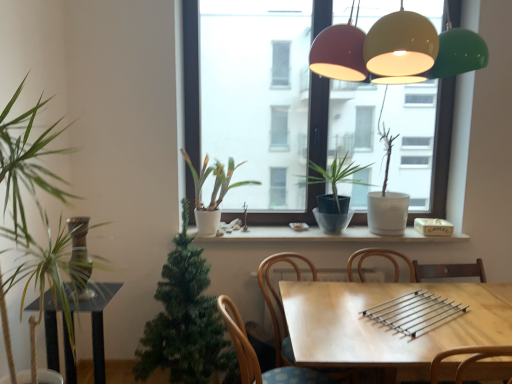
What do you see at coordinates (35, 203) in the screenshot? I see `green leafy plant at left, placed as the first houseplant when sorted from left to right` at bounding box center [35, 203].

In order to face green matte artificial tree at lower center, which is counted as the second houseplant, starting from the left, should I rotate leftwards or rightwards?

You should rotate left by 9.250 degrees.

Measure the distance between point (54, 357) and camera.

A distance of 7.43 feet exists between point (54, 357) and camera.

Describe the element at coordinates (334, 192) in the screenshot. I see `green matte plant at center, the 2th houseplant positioned from the right` at that location.

This screenshot has height=384, width=512. What are the coordinates of `wooden table at center` in the screenshot? It's located at (386, 326).

You are a GUI agent. You are given a task and a screenshot of the screen. Output one action in this format:
    pyautogui.click(x=<x>, y=<y>)
    Task: Click on the green leafy plant at left, placed as the first houseplant when sorted from left to right
    The width and height of the screenshot is (512, 384).
    Given the screenshot: What is the action you would take?
    pyautogui.click(x=35, y=203)

From the image's perspective, is green leafy plant at left, placed as the first houseplant when sorted from left to right, on wooden chair at center?

Yes, from the image's perspective, green leafy plant at left, placed as the first houseplant when sorted from left to right, is above wooden chair at center.

Which is more to the right, green leafy plant at left, positioned as the fifth houseplant in right-to-left order, or wooden chair at center?

wooden chair at center.

From a real-world perspective, which is physically below, green leafy plant at left, positioned as the fifth houseplant in right-to-left order, or wooden chair at center?

From a 3D spatial view, wooden chair at center is below.

Does point (104, 223) come farther from viewer compared to point (247, 352)?

Yes, it is behind point (247, 352).

Does wooden table at center touch green leafy plant at left, positioned as the fifth houseplant in right-to-left order?

No, wooden table at center is not touching green leafy plant at left, positioned as the fifth houseplant in right-to-left order.

Is point (373, 304) less distant than point (28, 256)?

No, (373, 304) is further to viewer.

The height and width of the screenshot is (384, 512). Identify the location of table behind the green leafy plant at left, positioned as the fifth houseplant in right-to-left order. (386, 326).

How far apart are wooden table at center and green leafy plant at left, positioned as the fifth houseplant in right-to-left order?

A distance of 1.25 meters exists between wooden table at center and green leafy plant at left, positioned as the fifth houseplant in right-to-left order.

Is white matte pot at center, which ranks as the 1th houseplant in right-to-left order, surrounded by green matte plant at center, marked as the 4th houseplant in a left-to-right arrangement?

That's incorrect, white matte pot at center, which ranks as the 1th houseplant in right-to-left order, is not inside green matte plant at center, marked as the 4th houseplant in a left-to-right arrangement.

Is green matte plant at center, the 2th houseplant positioned from the right, facing towards white matte pot at center, which ranks as the 1th houseplant in right-to-left order?

No, green matte plant at center, the 2th houseplant positioned from the right, is not turned towards white matte pot at center, which ranks as the 1th houseplant in right-to-left order.

Which houseplant is the 2nd one when counting from the front of the white matte pot at center, which ranks as the 1th houseplant in right-to-left order? Please provide its 2D coordinates.

[(334, 192)]

Would you say green leafy plant at left, positioned as the fifth houseplant in right-to-left order, is inside or outside green matte artificial tree at lower center, which is counted as the second houseplant, starting from the left?

green leafy plant at left, positioned as the fifth houseplant in right-to-left order, is not inside green matte artificial tree at lower center, which is counted as the second houseplant, starting from the left, it's outside.

Consider the image. Can you confirm if green leafy plant at left, placed as the first houseplant when sorted from left to right, is bigger than green matte artificial tree at lower center, which is counted as the second houseplant, starting from the left?

Actually, green leafy plant at left, placed as the first houseplant when sorted from left to right, might be smaller than green matte artificial tree at lower center, which is counted as the second houseplant, starting from the left.

Between point (19, 238) and point (212, 348), which one is positioned in front?

The point (19, 238) is closer to the camera.

Is the surface of green leafy plant at left, placed as the first houseplant when sorted from left to right, in direct contact with green matte artificial tree at lower center, the 4th houseplant positioned from the right?

No, green leafy plant at left, placed as the first houseplant when sorted from left to right, is not touching green matte artificial tree at lower center, the 4th houseplant positioned from the right.

Considering the sizes of transparent glass window at center and wooden chair at center in the image, is transparent glass window at center taller or shorter than wooden chair at center?

Clearly, transparent glass window at center is taller compared to wooden chair at center.

From a real-world perspective, which object stands above the other?

In real-world perspective, transparent glass window at center is above.

From the image's perspective, relative to wooden chair at center, is transparent glass window at center above or below?

Clearly, from the image's perspective, transparent glass window at center is above wooden chair at center.

Based on the photo, looking at their sizes, would you say white matte pot at center, which ranks as the 1th houseplant in right-to-left order, is wider or thinner than matte glass lampshades at upper center?

white matte pot at center, which ranks as the 1th houseplant in right-to-left order, is thinner than matte glass lampshades at upper center.

Find the location of a particular element. The height and width of the screenshot is (384, 512). lamp lying above the white matte pot at center, which is the fifth houseplant in left-to-right order (from the image's perspective) is located at coordinates (396, 51).

Is white matte pot at center, which is the fifth houseplant in left-to-right order, directly adjacent to matte glass lampshades at upper center?

No, white matte pot at center, which is the fifth houseplant in left-to-right order, is not making contact with matte glass lampshades at upper center.

Is point (389, 159) farther from viewer compared to point (344, 55)?

Yes.

At what (x,y) coordinates should I click in order to perform the action: click on houseplant that is the 3rd one when counting backward from the green matte artificial tree at lower center, which is counted as the second houseplant, starting from the left. Please return your answer as a coordinate pair (x, y). Looking at the image, I should click on (387, 198).

Would you say green matte artificial tree at lower center, the 4th houseplant positioned from the right, is inside or outside white matte pot at center, which ranks as the 1th houseplant in right-to-left order?

green matte artificial tree at lower center, the 4th houseplant positioned from the right, is not enclosed by white matte pot at center, which ranks as the 1th houseplant in right-to-left order.

Is green matte artificial tree at lower center, which is counted as the second houseplant, starting from the left, far from white matte pot at center, which ranks as the 1th houseplant in right-to-left order?

Indeed, green matte artificial tree at lower center, which is counted as the second houseplant, starting from the left, is not near white matte pot at center, which ranks as the 1th houseplant in right-to-left order.

From the image's perspective, would you say green matte artificial tree at lower center, which is counted as the second houseplant, starting from the left, is positioned over white matte pot at center, which is the fifth houseplant in left-to-right order?

No.

Which houseplant is the 3rd one when counting from the left side of the wooden chair at center? Please provide its 2D coordinates.

[(35, 203)]

Locate an element on the screen. This screenshot has width=512, height=384. table on the right of the green leafy plant at left, placed as the first houseplant when sorted from left to right is located at coordinates (386, 326).

Looking at the image, which one is located closer to black glass coffee table at lower left, wooden table at center or wooden chair at center?

wooden chair at center.

Based on their spatial positions, is white matte plant at center, positioned as the third houseplant in right-to-left order, or wooden table at center closer to white ceramic window sill at center?

white matte plant at center, positioned as the third houseplant in right-to-left order, is closer to white ceramic window sill at center.

Estimate the real-world distances between objects in this image. Which object is closer to transparent glass window at center, green matte artificial tree at lower center, which is counted as the second houseplant, starting from the left, or matte glass lampshades at upper center?

Among the two, green matte artificial tree at lower center, which is counted as the second houseplant, starting from the left, is located nearer to transparent glass window at center.

Which object lies further to the anchor point white matte pot at center, which is the fifth houseplant in left-to-right order, matte glass lampshades at upper center or white matte plant at center, positioned as the third houseplant in right-to-left order?

matte glass lampshades at upper center is further to white matte pot at center, which is the fifth houseplant in left-to-right order.

Estimate the real-world distances between objects in this image. Which object is further from transparent glass window at center, white matte pot at center, which ranks as the 1th houseplant in right-to-left order, or wooden table at center?

wooden table at center is positioned further to the anchor transparent glass window at center.

From the image, which object appears to be nearer to black glass coffee table at lower left, white ceramic window sill at center or transparent glass window at center?

white ceramic window sill at center is closer to black glass coffee table at lower left.

Estimate the real-world distances between objects in this image. Which object is closer to green matte artificial tree at lower center, the 4th houseplant positioned from the right, white matte plant at center, placed as the 3th houseplant when sorted from left to right, or white ceramic window sill at center?

Among the two, white matte plant at center, placed as the 3th houseplant when sorted from left to right, is located nearer to green matte artificial tree at lower center, the 4th houseplant positioned from the right.

Which object lies further to the anchor point green matte plant at center, the 2th houseplant positioned from the right, green leafy plant at left, positioned as the fifth houseplant in right-to-left order, or white matte plant at center, positioned as the third houseplant in right-to-left order?

green leafy plant at left, positioned as the fifth houseplant in right-to-left order, lies further to green matte plant at center, the 2th houseplant positioned from the right, than the other object.

Image resolution: width=512 pixels, height=384 pixels. I want to click on window sill between transparent glass window at center and green matte artificial tree at lower center, which is counted as the second houseplant, starting from the left, from top to bottom, so click(x=323, y=235).

Identify the location of coffee table positioned between matte glass lampshades at upper center and white matte plant at center, positioned as the third houseplant in right-to-left order, from near to far. The image size is (512, 384). (95, 319).

Locate an element on the screen. The image size is (512, 384). window sill located between black glass coffee table at lower left and green matte plant at center, the 2th houseplant positioned from the right, in the left-right direction is located at coordinates (323, 235).

Locate an element on the screen. table between wooden chair at center and green matte plant at center, marked as the 4th houseplant in a left-to-right arrangement, from front to back is located at coordinates (386, 326).